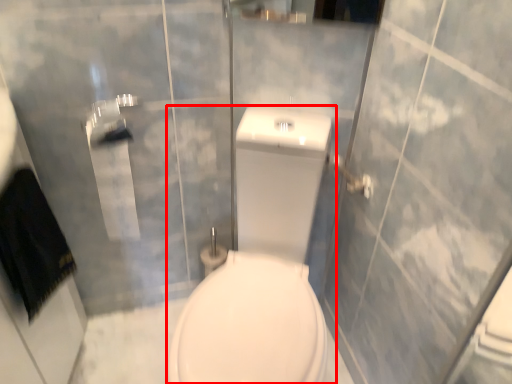
Question: From the image's perspective, where is porcelain (annotated by the red box) located in relation to towel bar in the image?

Choices:
 (A) above
 (B) below

Answer: (B)